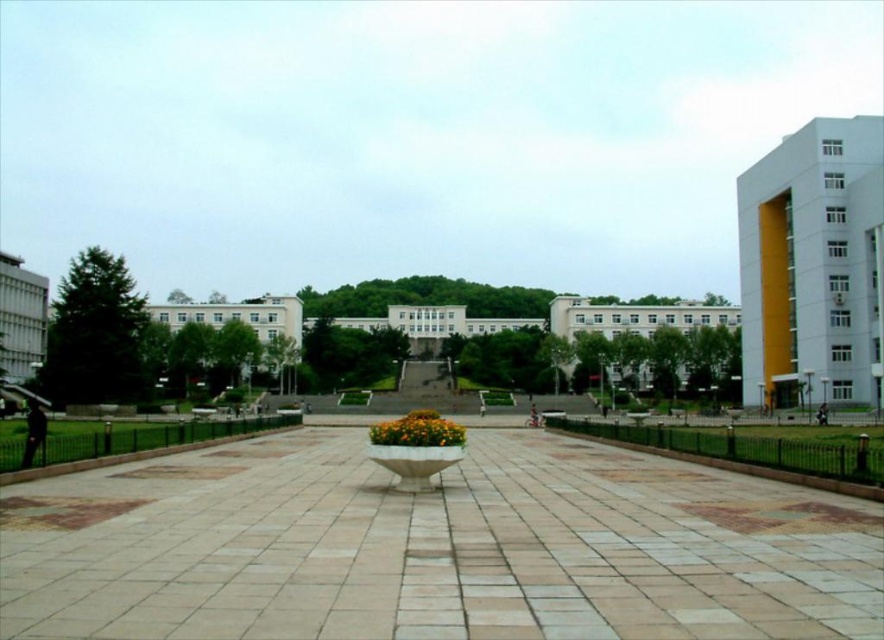
You are a landscape architect designing a new garden layout. You have to place a decorative fountain that requires a base area of 2 square meters. Given the white stone path at center and the yellow matte flower at center, which object can accommodate the fountain?

The yellow matte flower at center is larger than the white stone path at center, so the fountain can be placed on the yellow matte flower at center as it provides a larger base area.

You are a gardener who needs to water the yellow matte flower at center. However, there is a white stone path at center in the way. Can you reach the flower without stepping off the path?

The white stone path at center is positioned over the yellow matte flower at center, meaning the flower is underneath the path. Therefore, you cannot reach it without disturbing the path.

You are standing at the edge of the plaza and want to walk towards the yellow matte flower at center. Which direction should you move relative to the white stone path at center?

Since the white stone path at center is closer to the viewer than the yellow matte flower at center, you should move forward past the white stone path at center to reach the yellow matte flower at center.